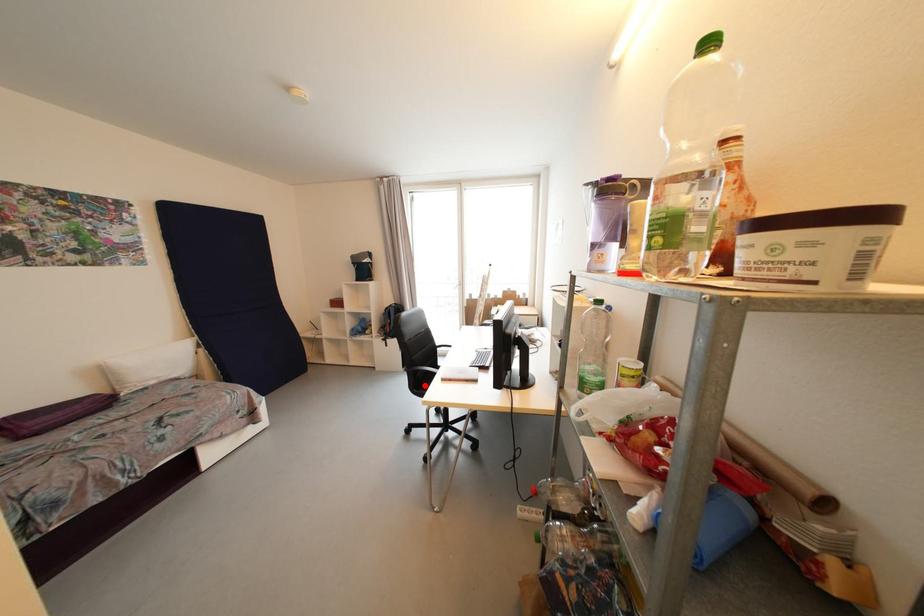
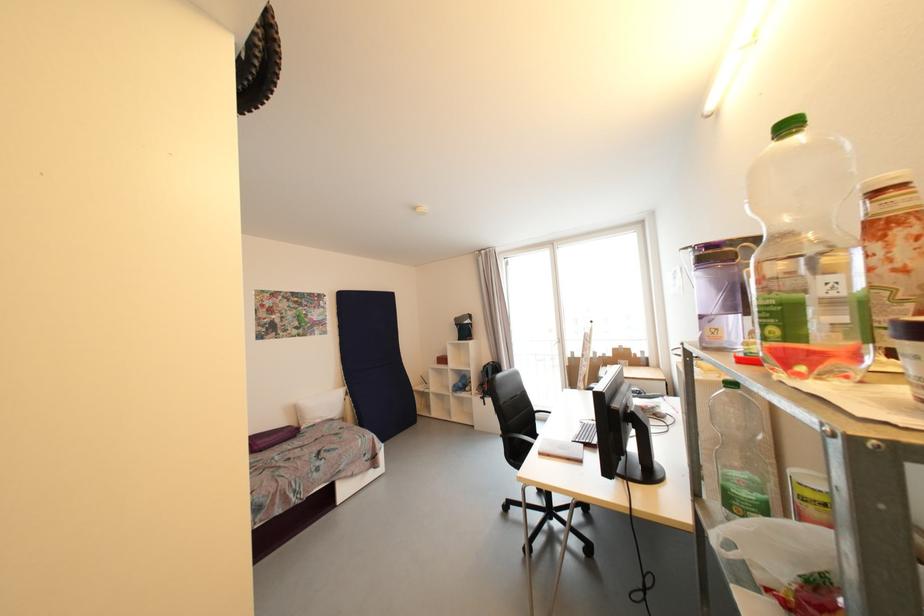
In the second image, find the point that corresponds to the highlighted location in the first image.

(520, 456)